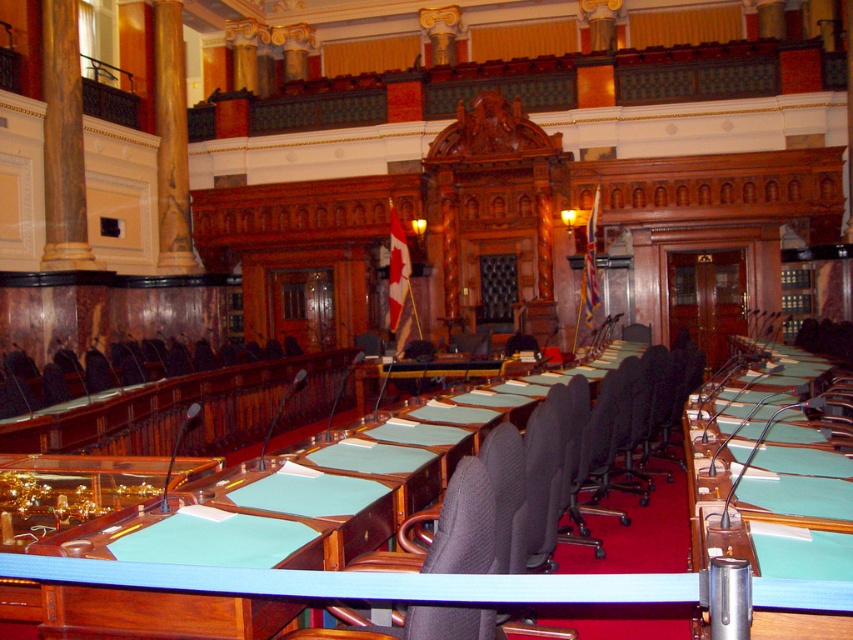
You are a visitor entering the legislative chamber and need to find a seat. You see the brown polished wood column at left and the matte black chair at left. Which object is closer to the entrance?

The brown polished wood column at left is closer to the entrance because the matte black chair at left is behind it.

You are a visitor entering the legislative chamber and need to find your assigned seat. You see the brown polished wood column at left and the matte black chair at left. Which object is closer to your left side as you face the chamber?

The brown polished wood column at left is positioned on the left side of the matte black chair at left, so the column is closer to your left side as you face the chamber.

You are an interior designer assessing the legislative chamber. You notice two columns at the left side of the chamber. Which column has a narrower width between the brown polished wood column at left and the rustic wood column at left?

The brown polished wood column at left has a lesser width compared to the rustic wood column at left, so the brown polished wood column at left is narrower.